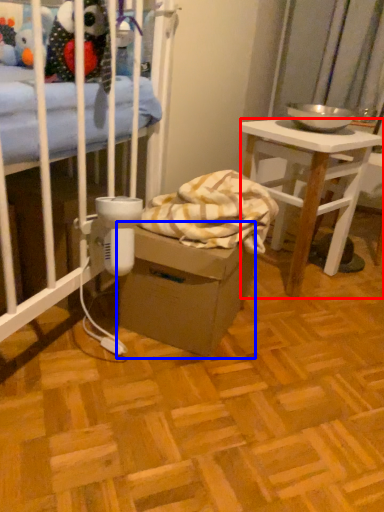
Question: Which object appears closest to the camera in this image, desk (highlighted by a red box) or cardboard box (highlighted by a blue box)?

Choices:
 (A) desk
 (B) cardboard box

Answer: (B)